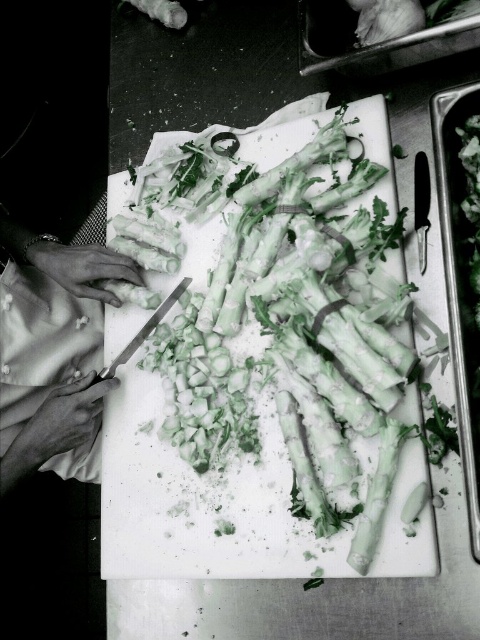
You are a chef working in a commercial kitchen. You need to place a new spice rack on the stainless steel counter. The spice rack requires a clear space of 20 cm in front of it. Is there enough space in front of the white plastic cutting board at center to accommodate the spice rack?

The white plastic cutting board at center is located at point (x=199, y=502). However, without knowing the dimensions of the counter or the distance from the cutting board to the edge, it is impossible to determine if there is sufficient space for the spice rack. Please provide more information about the counter dimensions or the required clearance area.

You are a chef holding a knife and need to reach the two points on the cutting board. The first point is at coordinate point (368, 104) and the second is at point (364, 44). Which point is closer to you?

Point (368, 104) is further to the camera than point (364, 44), so the second point at point (364, 44) is closer to you.